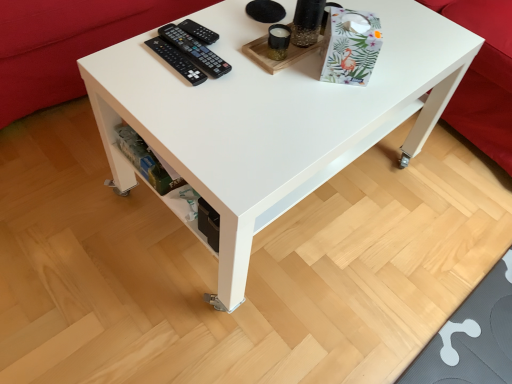
At what (x,y) coordinates should I click in order to perform the action: click on vacant region in front of black plastic remote controls at upper left, marked as the 1th control in a bottom-to-top arrangement. Please return your answer as a coordinate pair (x, y). The image size is (512, 384). Looking at the image, I should click on (186, 95).